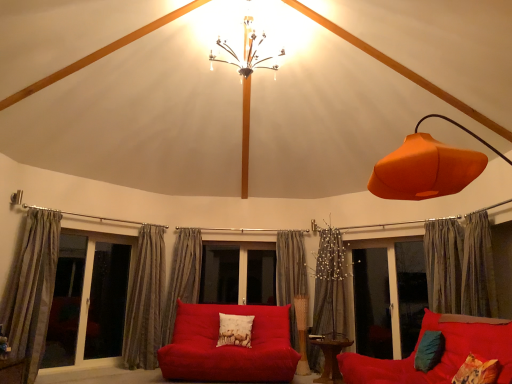
This screenshot has height=384, width=512. Describe the element at coordinates (234, 330) in the screenshot. I see `white cotton pillow with animal print at center, which is counted as the first pillow, starting from the back` at that location.

This screenshot has height=384, width=512. I want to click on printed fabric pillow at center, acting as the first pillow starting from the right, so click(477, 371).

This screenshot has height=384, width=512. What do you see at coordinates (460, 266) in the screenshot? I see `silky gray curtain at right, arranged as the 6th curtain when viewed from the left` at bounding box center [460, 266].

Describe the element at coordinates (388, 297) in the screenshot. I see `transparent glass window at center` at that location.

Measure the distance between transparent glass window at center and camera.

transparent glass window at center and camera are 5.54 meters apart.

The image size is (512, 384). Identify the location of teal fabric pillow at lower right, which ranks as the second pillow in left-to-right order. (429, 351).

You are a GUI agent. You are given a task and a screenshot of the screen. Output one action in this format:
    pyautogui.click(x=<x>, y=<y>)
    Task: Click on the white cotton pillow with animal print at center, which is the 3th pillow in right-to-left order
    The width and height of the screenshot is (512, 384).
    Given the screenshot: What is the action you would take?
    pyautogui.click(x=234, y=330)

Considering the relative sizes of wooden table at center and striped fabric curtain at center, the third curtain from the left, in the image provided, is wooden table at center smaller than striped fabric curtain at center, the third curtain from the left,?

Yes.

From a real-world perspective, which is physically below, wooden table at center or striped fabric curtain at center, the fourth curtain when ordered from right to left?

In real-world perspective, wooden table at center is lower.

From the image's perspective, is wooden table at center above striped fabric curtain at center, the third curtain from the left?

Incorrect, from the image's perspective, wooden table at center is lower than striped fabric curtain at center, the third curtain from the left.

How many degrees apart are the facing directions of wooden table at center and striped fabric curtain at center, the third curtain from the left?

21 degrees.

Are metallic chandelier at upper center and transparent glass screen door at center, positioned as the second screen door in left-to-right order, far apart?

Yes, metallic chandelier at upper center and transparent glass screen door at center, positioned as the second screen door in left-to-right order, are located far from each other.

From the picture: Does metallic chandelier at upper center turn towards transparent glass screen door at center, acting as the first screen door starting from the right?

No, metallic chandelier at upper center is not facing towards transparent glass screen door at center, acting as the first screen door starting from the right.

Locate an element on the screen. The height and width of the screenshot is (384, 512). lamp above the transparent glass screen door at center, acting as the first screen door starting from the right (from the image's perspective) is located at coordinates (247, 51).

Considering the relative positions of teal fabric pillow at lower right, which is counted as the second pillow, starting from the back, and metallic chandelier at upper center in the image provided, is teal fabric pillow at lower right, which is counted as the second pillow, starting from the back, in front of metallic chandelier at upper center?

No, teal fabric pillow at lower right, which is counted as the second pillow, starting from the back, is further to the viewer.

Considering the relative sizes of teal fabric pillow at lower right, which is counted as the second pillow, starting from the back, and metallic chandelier at upper center in the image provided, is teal fabric pillow at lower right, which is counted as the second pillow, starting from the back, thinner than metallic chandelier at upper center?

Yes.

Between point (439, 348) and point (243, 34), which one is positioned behind?

The point (243, 34) is farther from the camera.

What's the angular difference between teal fabric pillow at lower right, acting as the second pillow starting from the front, and metallic chandelier at upper center's facing directions?

94.1 degrees.

Who is more distant, transparent glass window at center or matte glass window at left?

transparent glass window at center is more distant.

In the scene shown: Which object is positioned more to the left, transparent glass window at center or matte glass window at left?

matte glass window at left is more to the left.

Looking at this image, is transparent glass window at center next to matte glass window at left?

No, transparent glass window at center is not making contact with matte glass window at left.

Which is less distant, (389, 293) or (54, 322)?

Positioned in front is point (54, 322).

Is there a large distance between transparent glass screen door at center, positioned as the second screen door in left-to-right order, and striped fabric curtain at left, the 1th curtain in the left-to-right sequence?

Indeed, transparent glass screen door at center, positioned as the second screen door in left-to-right order, is not near striped fabric curtain at left, the 1th curtain in the left-to-right sequence.

Between transparent glass screen door at center, positioned as the second screen door in left-to-right order, and striped fabric curtain at left, which ranks as the 6th curtain in right-to-left order, which one has larger width?

Wider between the two is striped fabric curtain at left, which ranks as the 6th curtain in right-to-left order.

From the image's perspective, which is below, transparent glass screen door at center, acting as the first screen door starting from the right, or striped fabric curtain at left, the 1th curtain in the left-to-right sequence?

From the image's view, transparent glass screen door at center, acting as the first screen door starting from the right, is below.

Which is more to the left, transparent glass screen door at center, positioned as the second screen door in left-to-right order, or striped fabric curtain at left, which ranks as the 6th curtain in right-to-left order?

striped fabric curtain at left, which ranks as the 6th curtain in right-to-left order, is more to the left.

Considering the relative sizes of silky gray curtain at right, arranged as the 6th curtain when viewed from the left, and silky gray curtain at center, acting as the fifth curtain starting from the left, in the image provided, is silky gray curtain at right, arranged as the 6th curtain when viewed from the left, smaller than silky gray curtain at center, acting as the fifth curtain starting from the left,?

Correct, silky gray curtain at right, arranged as the 6th curtain when viewed from the left, occupies less space than silky gray curtain at center, acting as the fifth curtain starting from the left.

Is silky gray curtain at center, the 2th curtain viewed from the right, at the back of silky gray curtain at right, arranged as the 6th curtain when viewed from the left?

That's not correct — silky gray curtain at right, arranged as the 6th curtain when viewed from the left, is not looking away from silky gray curtain at center, the 2th curtain viewed from the right.

Which of these two, silky gray curtain at right, arranged as the 6th curtain when viewed from the left, or silky gray curtain at center, acting as the fifth curtain starting from the left, is wider?

With larger width is silky gray curtain at center, acting as the fifth curtain starting from the left.

Can you see silky gray curtain at right, arranged as the 6th curtain when viewed from the left, touching silky gray curtain at center, acting as the fifth curtain starting from the left?

No.

Is striped fabric curtain at center, the fourth curtain when ordered from right to left, beside teal fabric pillow at lower right, acting as the second pillow starting from the front?

striped fabric curtain at center, the fourth curtain when ordered from right to left, and teal fabric pillow at lower right, acting as the second pillow starting from the front, are clearly separated.

Measure the distance from striped fabric curtain at center, the fourth curtain when ordered from right to left, to teal fabric pillow at lower right, acting as the second pillow starting from the front.

They are 3.29 meters apart.

From their relative heights in the image, would you say striped fabric curtain at center, the third curtain from the left, is taller or shorter than teal fabric pillow at lower right, which ranks as the 2th pillow in right-to-left order?

striped fabric curtain at center, the third curtain from the left, is taller than teal fabric pillow at lower right, which ranks as the 2th pillow in right-to-left order.

Considering the points (181, 260) and (424, 364), which point is behind, point (181, 260) or point (424, 364)?

The point (181, 260) is farther.

Image resolution: width=512 pixels, height=384 pixels. I want to click on the 4th curtain directly above the wooden table at center (from a real-world perspective), so click(x=182, y=278).

This screenshot has width=512, height=384. I want to click on the 2nd screen door positioned below the metallic chandelier at upper center (from the image's perspective), so click(372, 303).

When comparing their distances from matte red studio couch at center, which appears as the second studio couch when viewed from the front, does transparent glass window at center or silky gray curtain at center, acting as the fifth curtain starting from the left, seem closer?

silky gray curtain at center, acting as the fifth curtain starting from the left, lies closer to matte red studio couch at center, which appears as the second studio couch when viewed from the front, than the other object.

Looking at the image, which one is located further to printed fabric pillow at center, the third pillow when ordered from left to right, transparent glass screen door at center, positioned as the second screen door in left-to-right order, or wooden table at center?

Based on the image, transparent glass screen door at center, positioned as the second screen door in left-to-right order, appears to be further to printed fabric pillow at center, the third pillow when ordered from left to right.

From the image, which object appears to be nearer to silky gray curtain at center, acting as the fifth curtain starting from the left, transparent glass window at center or wooden table at center?

wooden table at center.

Which object lies further to the anchor point transparent glass screen door at center, acting as the first screen door starting from the right, matte glass window at left or printed fabric pillow at center, acting as the first pillow starting from the right?

The object further to transparent glass screen door at center, acting as the first screen door starting from the right, is matte glass window at left.

Consider the image. Which object lies nearer to the anchor point matte red studio couch at center, arranged as the first studio couch when viewed from the left, printed fabric pillow at center, the third pillow when ordered from left to right, or white glass screen door at left, the second screen door from the right?

Among the two, white glass screen door at left, the second screen door from the right, is located nearer to matte red studio couch at center, arranged as the first studio couch when viewed from the left.

Estimate the real-world distances between objects in this image. Which object is closer to transparent glass screen door at center, positioned as the second screen door in left-to-right order, printed fabric pillow at center, acting as the first pillow starting from the right, or white cotton pillow with animal print at center, arranged as the 1th pillow when viewed from the left?

white cotton pillow with animal print at center, arranged as the 1th pillow when viewed from the left, is closer to transparent glass screen door at center, positioned as the second screen door in left-to-right order.

Looking at this image, from the image, which object appears to be farther from striped fabric curtain at lower left, the fifth curtain when ordered from right to left, matte red couch at lower right, placed as the first studio couch when sorted from right to left, or metallic chandelier at upper center?

The object further to striped fabric curtain at lower left, the fifth curtain when ordered from right to left, is matte red couch at lower right, placed as the first studio couch when sorted from right to left.

Considering their positions, is striped fabric curtain at lower left, which ranks as the 2th curtain in left-to-right order, positioned further to striped fabric curtain at center, which is the fourth curtain in left-to-right order, than printed fabric pillow at center, which is the 1th pillow from front to back?

Based on the image, printed fabric pillow at center, which is the 1th pillow from front to back, appears to be further to striped fabric curtain at center, which is the fourth curtain in left-to-right order.

In order to click on bay window positioned between striped fabric curtain at left, the 1th curtain in the left-to-right sequence, and striped fabric curtain at lower left, which ranks as the 2th curtain in left-to-right order, from near to far in this screenshot , I will do `click(90, 300)`.

At what (x,y) coordinates should I click in order to perform the action: click on pillow situated between white glass screen door at left, the second screen door from the right, and wooden table at center from left to right. Please return your answer as a coordinate pair (x, y). The width and height of the screenshot is (512, 384). Looking at the image, I should click on (234, 330).

Find the location of `table between teal fabric pillow at lower right, which ranks as the 2th pillow in right-to-left order, and transparent glass screen door at center, acting as the first screen door starting from the right, along the z-axis`. table between teal fabric pillow at lower right, which ranks as the 2th pillow in right-to-left order, and transparent glass screen door at center, acting as the first screen door starting from the right, along the z-axis is located at coordinates (330, 356).

Identify the location of window screen situated between striped fabric curtain at center, which is the fourth curtain in left-to-right order, and silky gray curtain at right, arranged as the 6th curtain when viewed from the left, from left to right. (388, 297).